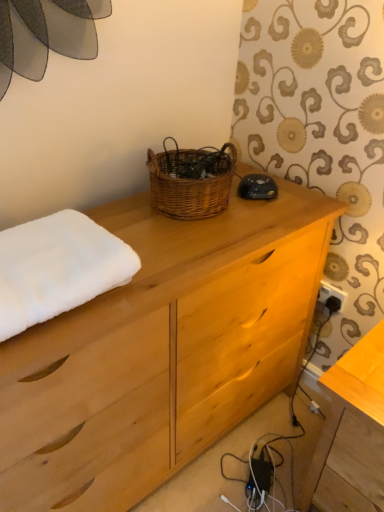
This screenshot has width=384, height=512. Identify the location of free space above natural wood chest of drawers at center (from a real-world perspective). (194, 241).